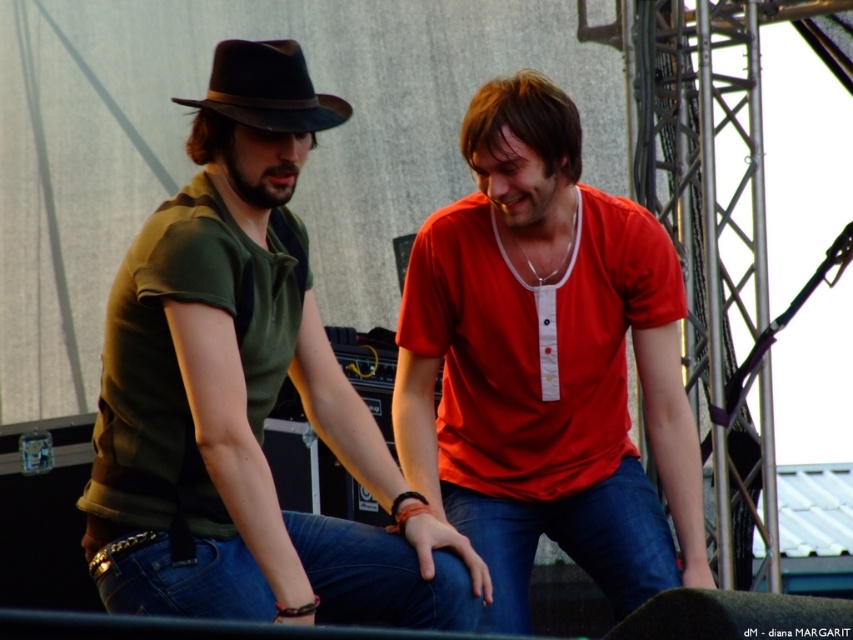
You are a photographer setting up for an event. You notice the blue denim jeans at center and the black felt fedora at upper left in your viewfinder. Which object should you adjust your camera to focus on first if you want to capture both in the same frame without moving the camera?

You should focus on the black felt fedora at upper left first because it is positioned to the left of the blue denim jeans at center, allowing both to be included in the frame by adjusting focus from left to right.

You are a photographer setting up for an event. You notice two items in the scene that might interfere with your shot. The denim at center and the black felt fedora at upper left. Which item is more likely to block the background curtain if placed closer to the camera?

The denim at center is much taller than the black felt fedora at upper left, so it would block the background curtain more if placed closer to the camera.

You are a photographer setting up for an event. You need to decide which item to focus on first based on their sizes. Given that you want to focus on the larger object first, which one should you choose between the denim at center and the black felt fedora at upper left?

The denim at center has a larger size compared to the black felt fedora at upper left, so you should focus on the denim at center first.